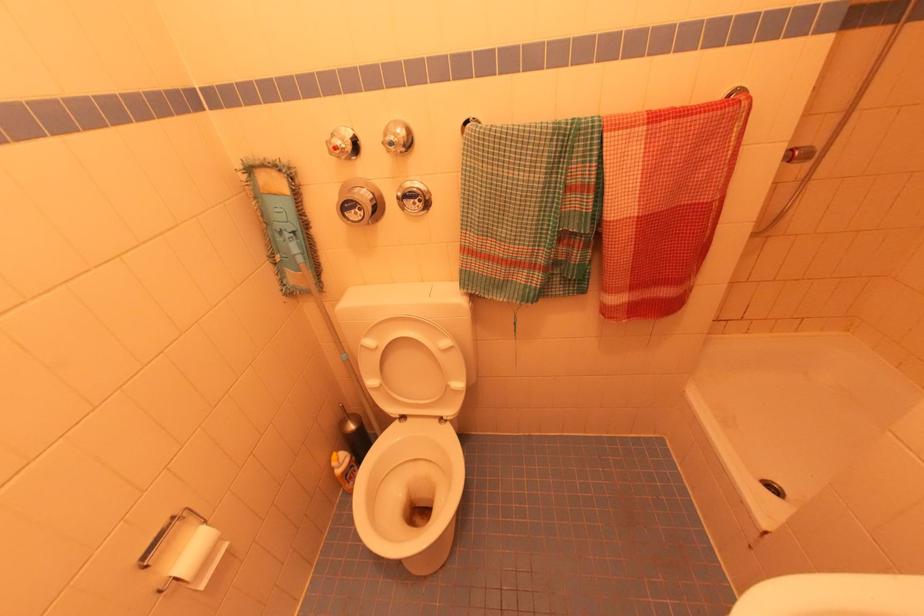
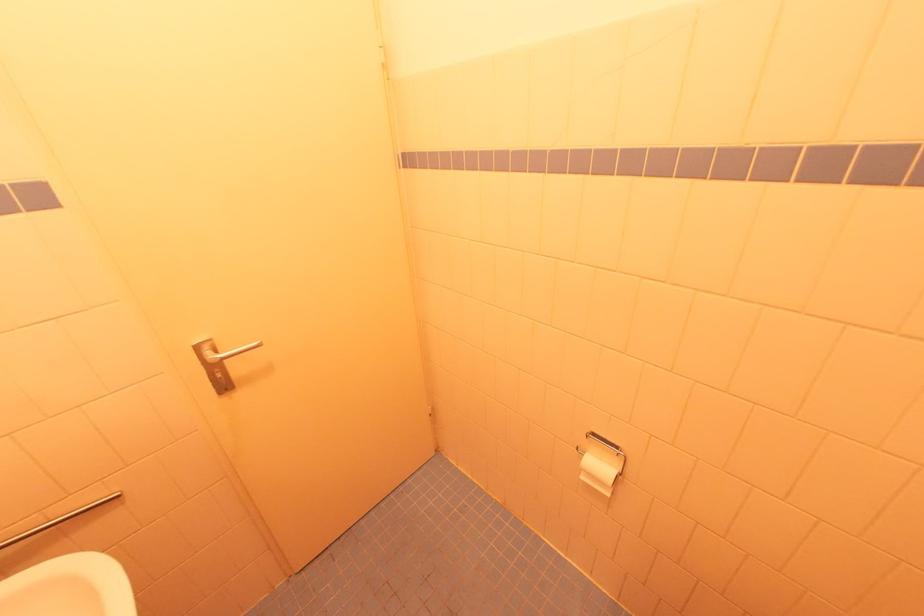
Locate, in the second image, the point that corresponds to the point at 204,586 in the first image.

(585, 479)